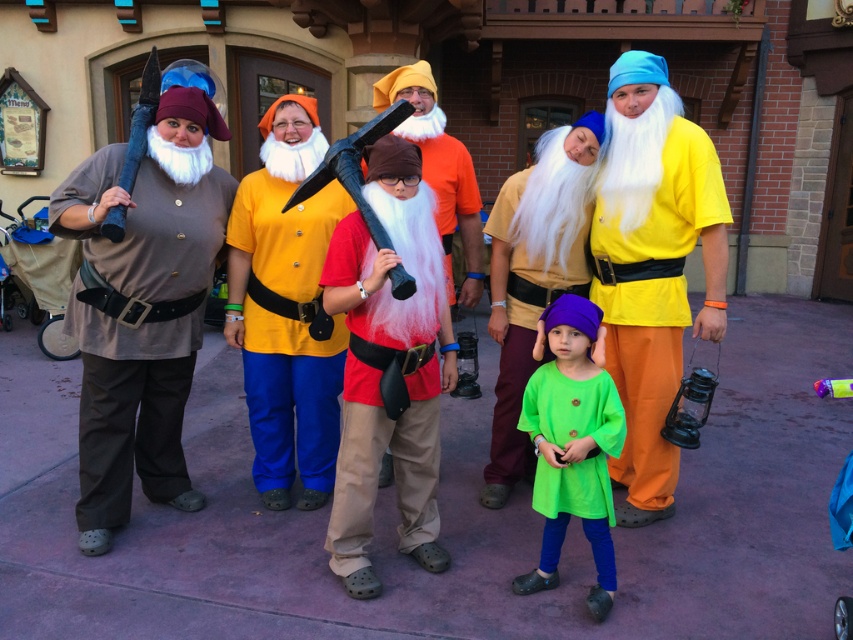
Question: Is red cotton shirt at center wider than yellow matte shirt at center?

Choices:
 (A) no
 (B) yes

Answer: (A)

Question: Estimate the real-world distances between objects in this image. Which object is farther from the matte yellow shirt at center?

Choices:
 (A) green fabric dress at center
 (B) yellow matte shirt at center
 (C) matte red axe at center

Answer: (B)

Question: Estimate the real-world distances between objects in this image. Which object is closer to the green fabric dress at center?

Choices:
 (A) matte yellow shirt at center
 (B) matte red axe at center
 (C) matte brown shirt at center

Answer: (C)

Question: Can you confirm if matte brown shirt at center is positioned below green fabric dress at center?

Choices:
 (A) no
 (B) yes

Answer: (A)

Question: Where is red cotton shirt at center located in relation to yellow matte shirt at center in the image?

Choices:
 (A) left
 (B) right

Answer: (B)

Question: Considering the real-world distances, which object is closest to the red cotton shirt at center?

Choices:
 (A) green fabric dress at center
 (B) brown fabric shirt at left
 (C) matte brown shirt at center

Answer: (A)